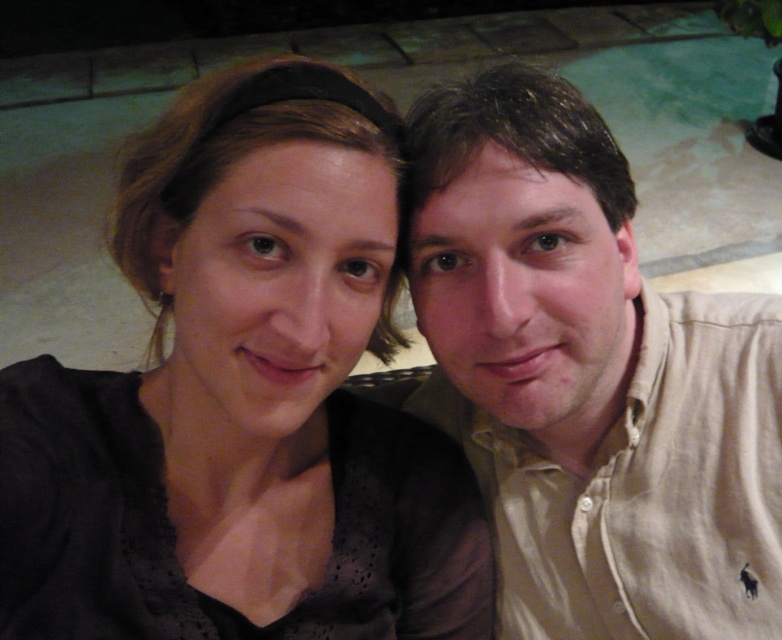
Question: Is matte black top at center positioned before beige cotton shirt at right?

Choices:
 (A) yes
 (B) no

Answer: (A)

Question: Which point is farther from the camera taking this photo?

Choices:
 (A) (657, 593)
 (B) (207, 196)

Answer: (A)

Question: Does matte black top at center have a smaller size compared to beige cotton shirt at right?

Choices:
 (A) no
 (B) yes

Answer: (A)

Question: Does matte black top at center have a lesser width compared to beige cotton shirt at right?

Choices:
 (A) yes
 (B) no

Answer: (B)

Question: Which point is closer to the camera?

Choices:
 (A) (160, 195)
 (B) (439, 410)

Answer: (A)